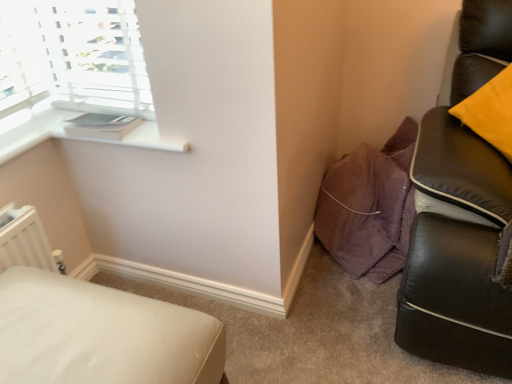
Question: From the image's perspective, is white fabric ottoman at lower left located above white matte window sill at upper left?

Choices:
 (A) yes
 (B) no

Answer: (B)

Question: Is white fabric ottoman at lower left completely or partially outside of white matte window sill at upper left?

Choices:
 (A) yes
 (B) no

Answer: (A)

Question: From a real-world perspective, is white fabric ottoman at lower left positioned over white matte window sill at upper left based on gravity?

Choices:
 (A) yes
 (B) no

Answer: (B)

Question: Can you confirm if white fabric ottoman at lower left is positioned to the right of white matte window sill at upper left?

Choices:
 (A) no
 (B) yes

Answer: (A)

Question: Considering the relative sizes of white fabric ottoman at lower left and white matte window sill at upper left in the image provided, is white fabric ottoman at lower left thinner than white matte window sill at upper left?

Choices:
 (A) yes
 (B) no

Answer: (B)

Question: Is white fabric ottoman at lower left oriented towards white matte window sill at upper left?

Choices:
 (A) no
 (B) yes

Answer: (A)

Question: From a real-world perspective, is white matte window sill at upper left positioned over white fabric ottoman at lower left based on gravity?

Choices:
 (A) no
 (B) yes

Answer: (B)

Question: Can you confirm if white matte window sill at upper left is wider than white fabric ottoman at lower left?

Choices:
 (A) yes
 (B) no

Answer: (B)

Question: Can you confirm if white matte window sill at upper left is taller than white fabric ottoman at lower left?

Choices:
 (A) yes
 (B) no

Answer: (B)

Question: Is white matte window sill at upper left looking in the opposite direction of white fabric ottoman at lower left?

Choices:
 (A) no
 (B) yes

Answer: (A)

Question: Is the position of white matte window sill at upper left more distant than that of white fabric ottoman at lower left?

Choices:
 (A) no
 (B) yes

Answer: (B)

Question: Considering the relative positions of white matte window sill at upper left and white fabric ottoman at lower left in the image provided, is white matte window sill at upper left to the left of white fabric ottoman at lower left from the viewer's perspective?

Choices:
 (A) yes
 (B) no

Answer: (B)

Question: From the image's perspective, is white matte window sill at upper left located above or below white fabric ottoman at lower left?

Choices:
 (A) above
 (B) below

Answer: (A)